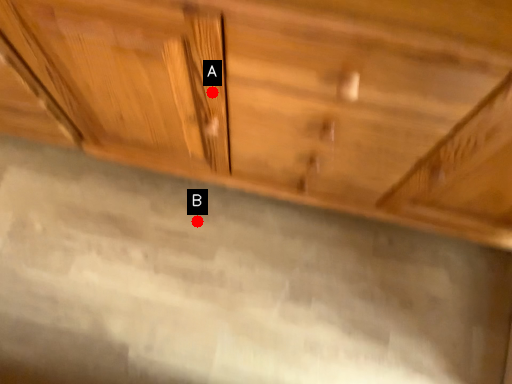
Question: Two points are circled on the image, labeled by A and B beside each circle. Which point is farther to the camera?

Choices:
 (A) A is further
 (B) B is further

Answer: (B)